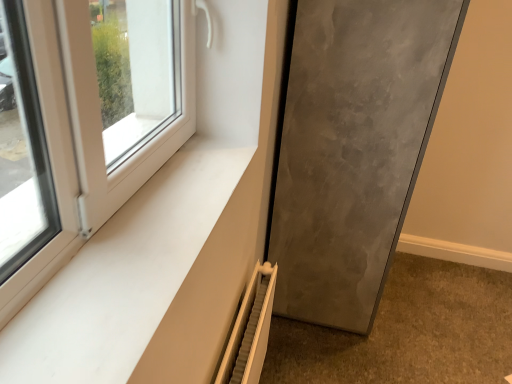
Where is `free space in front of matte gray door at lower right`? The width and height of the screenshot is (512, 384). free space in front of matte gray door at lower right is located at coordinates (351, 352).